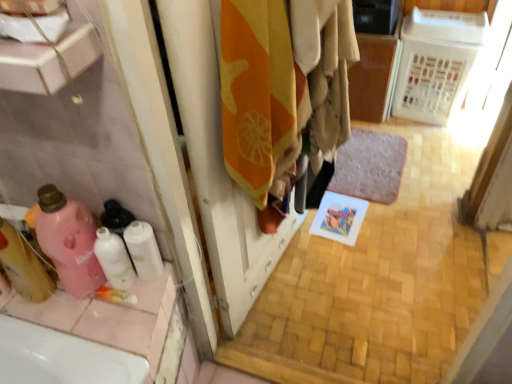
I want to click on vacant space that is in between orange fabric at center and gray plush bath mat at center, so click(326, 241).